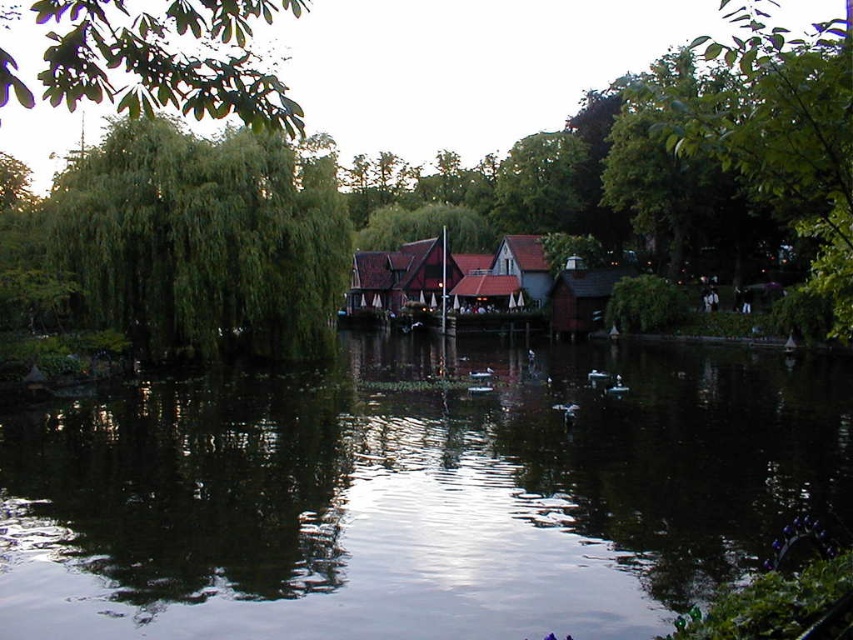
Question: In this image, where is green leafy tree at center located relative to wooden hut at center?

Choices:
 (A) left
 (B) right

Answer: (A)

Question: Which point appears closest to the camera in this image?

Choices:
 (A) (317, 179)
 (B) (606, 269)
 (C) (445, 624)

Answer: (C)

Question: From the image, what is the correct spatial relationship of green leafy tree at center in relation to brown wooden hut at center?

Choices:
 (A) right
 (B) left

Answer: (B)

Question: Is dark reflective water at center positioned before green leafy tree at center?

Choices:
 (A) yes
 (B) no

Answer: (B)

Question: Which object is the farthest from the green leafy tree at upper left?

Choices:
 (A) dark reflective water at center
 (B) green leafy tree at center
 (C) brown wooden hut at center

Answer: (A)

Question: Which of the following is the closest to the observer?

Choices:
 (A) green leafy tree at left
 (B) brown wooden hut at center
 (C) dark reflective water at center
 (D) green leafy tree at upper left

Answer: (D)